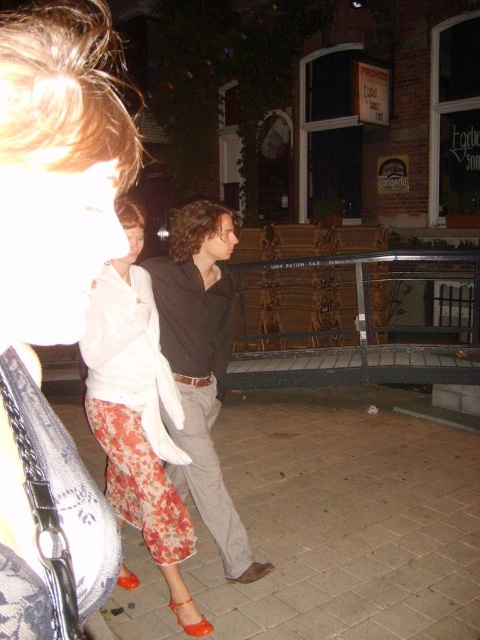
Who is higher up, smooth concrete pavement at center or floral fabric pants at center?

floral fabric pants at center is above.

Between smooth concrete pavement at center and floral fabric pants at center, which one is positioned lower?

smooth concrete pavement at center is lower down.

Does point (333, 452) lie in front of point (145, 276)?

No, (333, 452) is further to viewer.

This screenshot has width=480, height=640. In order to click on smooth concrete pavement at center in this screenshot , I will do `click(347, 518)`.

Can you confirm if floral fabric pants at lower left is smaller than dark brown leather jacket at center?

Yes.

Which is behind, point (26, 17) or point (210, 435)?

The point (26, 17) is behind.

This screenshot has height=640, width=480. Identify the location of floral fabric pants at lower left. (54, 305).

Does point (132, 582) lie in front of point (194, 294)?

No, it is behind (194, 294).

Which is behind, point (151, 316) or point (193, 209)?

Point (193, 209)

This screenshot has height=640, width=480. I want to click on floral fabric pants at center, so click(x=137, y=413).